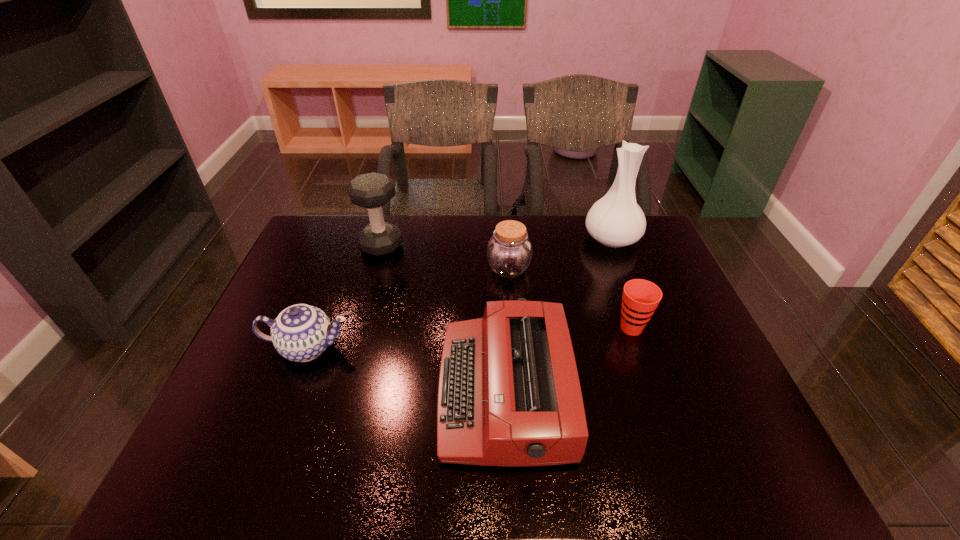
You are a GUI agent. You are given a task and a screenshot of the screen. Output one action in this format:
    pyautogui.click(x=<x>, y=<y>)
    Task: Click on the vase
    The image size is (960, 540).
    Given the screenshot: What is the action you would take?
    pyautogui.click(x=616, y=220)

Locate an element on the screen. The height and width of the screenshot is (540, 960). the fifth shortest object is located at coordinates (373, 190).

This screenshot has height=540, width=960. Identify the location of jar. (509, 252).

Locate an element on the screen. Image resolution: width=960 pixels, height=540 pixels. chinaware is located at coordinates (301, 332).

Identify the location of cup. pos(640,298).

Identify the location of typewriter. The height and width of the screenshot is (540, 960). (509, 394).

I want to click on free space located 0.110m on the left of the tallest object, so click(x=551, y=239).

You are a GUI agent. You are given a task and a screenshot of the screen. Output one action in this format:
    pyautogui.click(x=<x>, y=<y>)
    Task: Click on the vacant space situated on the front of the dumbbell
    
    Given the screenshot: What is the action you would take?
    pyautogui.click(x=357, y=331)

Identify the location of free space located on the left of the jar. The width and height of the screenshot is (960, 540). (387, 269).

You are a GUI agent. You are given a task and a screenshot of the screen. Output one action in this format:
    pyautogui.click(x=<x>, y=<y>)
    Task: Click on the free region located at the spout of the chinaware
    The width and height of the screenshot is (960, 540).
    Given the screenshot: What is the action you would take?
    pyautogui.click(x=469, y=348)